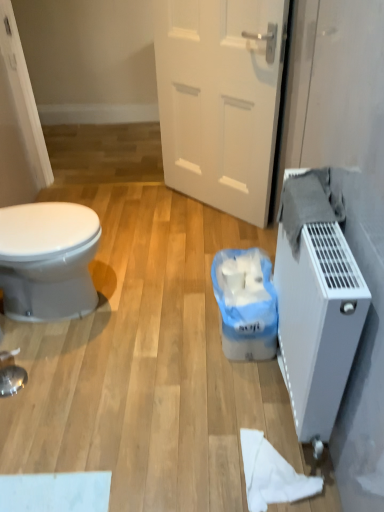
Identify the location of free spot in front of white matte door at center. The image size is (384, 512). (185, 249).